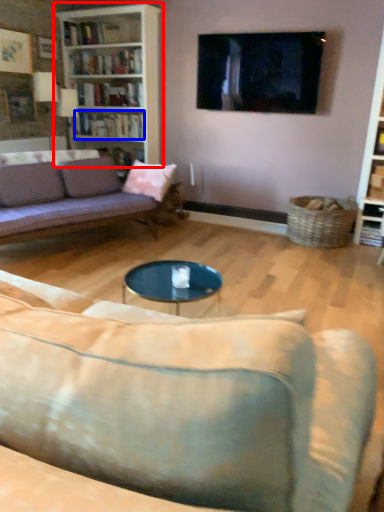
Question: Which of the following is the farthest to the observer, bookcase (highlighted by a red box) or book (highlighted by a blue box)?

Choices:
 (A) bookcase
 (B) book

Answer: (B)